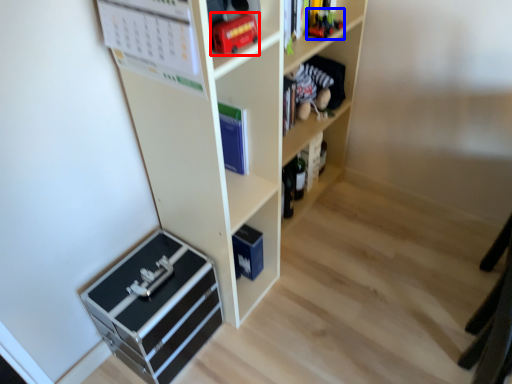
Question: Among these objects, which one is farthest to the camera, toy (highlighted by a red box) or toy (highlighted by a blue box)?

Choices:
 (A) toy
 (B) toy

Answer: (B)